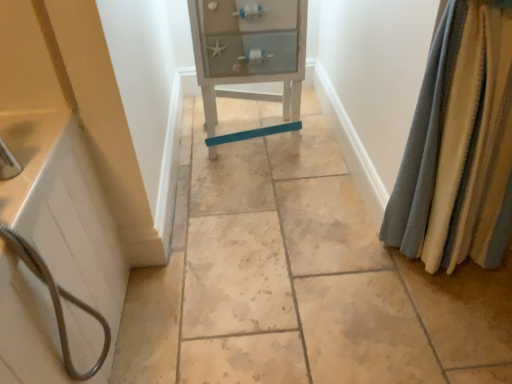
Question: From a real-world perspective, is white matte bathtub at left above or below white wood cabinet at center?

Choices:
 (A) below
 (B) above

Answer: (B)

Question: Considering the positions of white matte bathtub at left and white wood cabinet at center in the image, is white matte bathtub at left taller or shorter than white wood cabinet at center?

Choices:
 (A) tall
 (B) short

Answer: (A)

Question: Which is nearer to the white matte bathtub at left?

Choices:
 (A) velvet-like beige curtains at right
 (B) white wood cabinet at center

Answer: (B)

Question: Which of these objects is positioned farthest from the white wood cabinet at center?

Choices:
 (A) white matte bathtub at left
 (B) velvet-like beige curtains at right

Answer: (A)